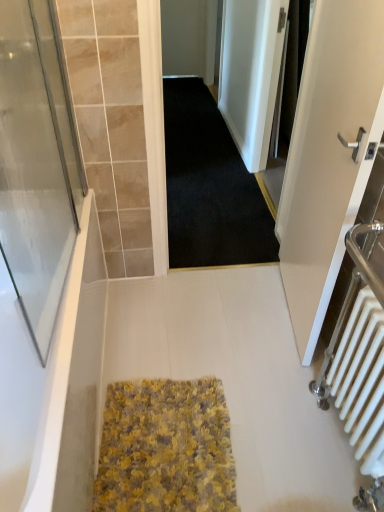
Image resolution: width=384 pixels, height=512 pixels. Find the location of `vacant space behind yellow textured rug at center`. vacant space behind yellow textured rug at center is located at coordinates (186, 342).